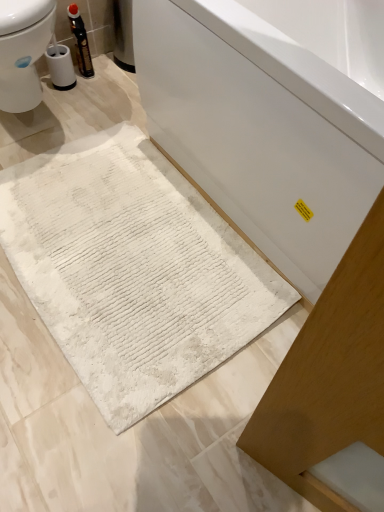
Question: Is white textured bath mat at lower center bigger or smaller than matte black bottle at upper left?

Choices:
 (A) small
 (B) big

Answer: (B)

Question: Relative to matte black bottle at upper left, is white textured bath mat at lower center in front or behind?

Choices:
 (A) behind
 (B) front

Answer: (B)

Question: Estimate the real-world distances between objects in this image. Which object is closer to the matte black bottle at upper left?

Choices:
 (A) white glossy bathtub at center
 (B) white textured bath mat at lower center

Answer: (B)

Question: Which object is the closest to the white glossy bathtub at center?

Choices:
 (A) matte black bottle at upper left
 (B) white textured bath mat at lower center

Answer: (B)